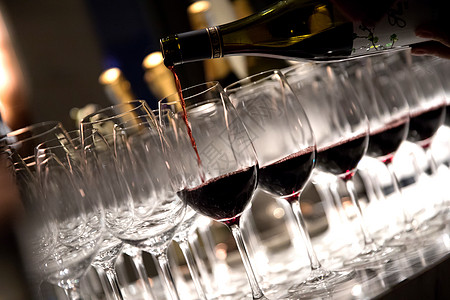
You are a GUI agent. You are given a task and a screenshot of the screen. Output one action in this format:
    pyautogui.click(x=<x>, y=<y>)
    Task: Click on the glasses with red wine
    This screenshot has width=450, height=300.
    Given the screenshot: What is the action you would take?
    pyautogui.click(x=233, y=201), pyautogui.click(x=297, y=181), pyautogui.click(x=345, y=152), pyautogui.click(x=398, y=135), pyautogui.click(x=426, y=121), pyautogui.click(x=448, y=119)